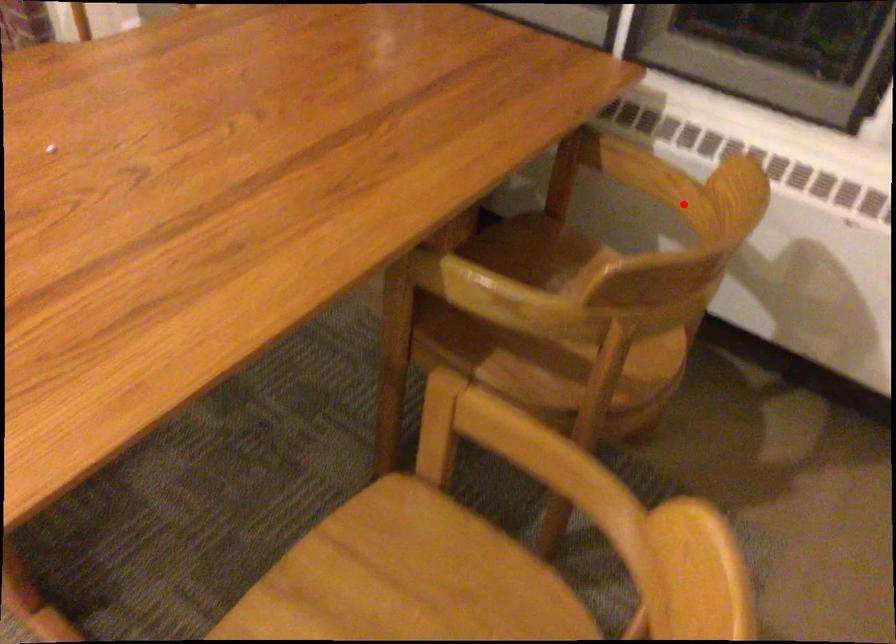
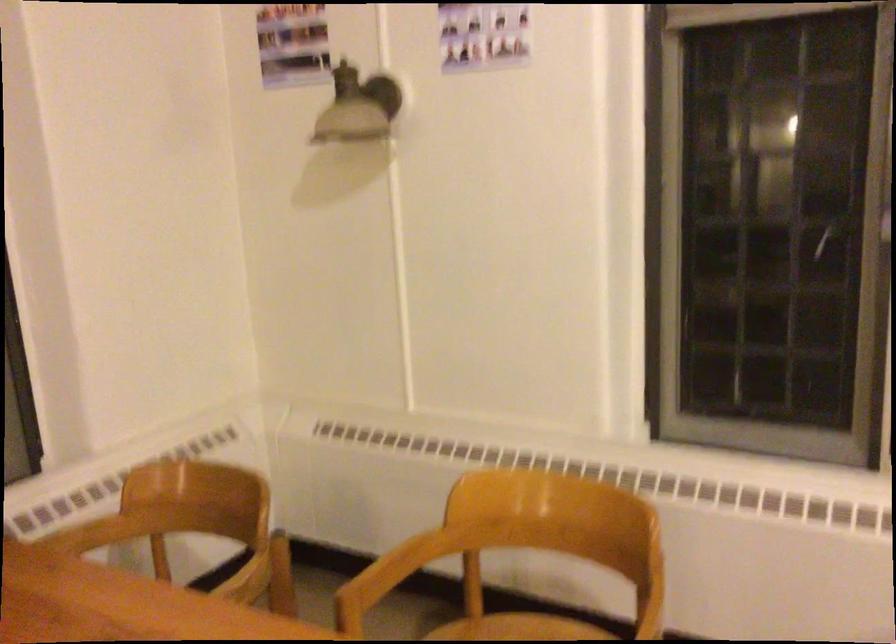
Locate, in the second image, the point that corresponds to the highlighted location in the first image.

(92, 534)